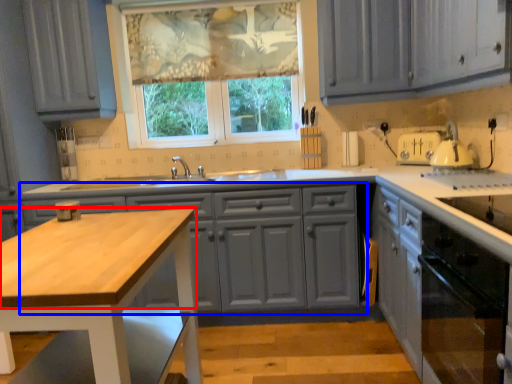
Question: Which of the following is the closest to the observer, countertop (highlighted by a red box) or cabinetry (highlighted by a blue box)?

Choices:
 (A) countertop
 (B) cabinetry

Answer: (A)